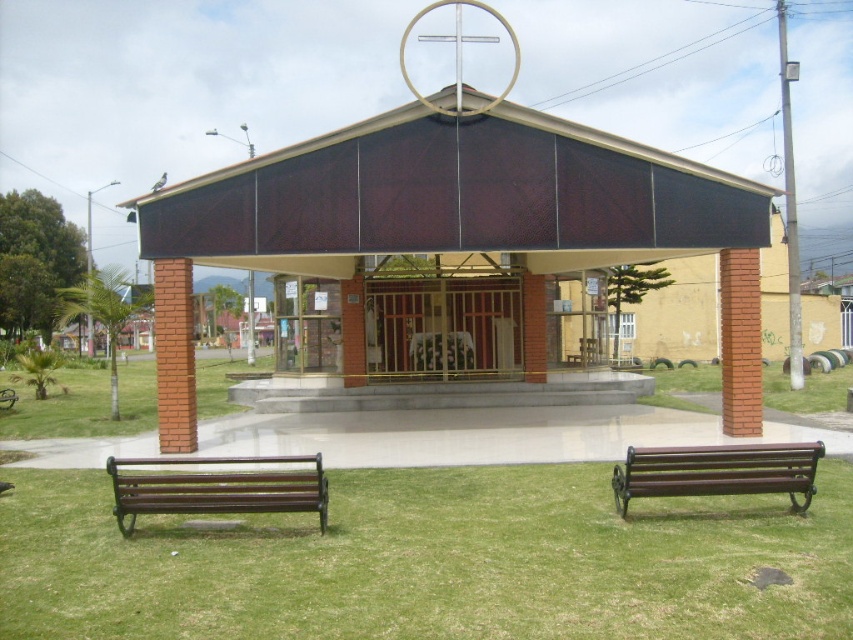
You are a visitor at this chapel and want to sit down. There are two benches available. The brown polished wood bench at lower left and the brown wooden bench at lower right. Which bench is positioned more to the left side of the scene?

The brown polished wood bench at lower left is positioned more to the left side of the scene compared to the brown wooden bench at lower right.

You are standing in front of the matte brown chapel at center and want to walk towards the green grass at lower center. In which direction should you move relative to the chapel?

The green grass at lower center is positioned on the right side of matte brown chapel at center, so you should move to the right of the chapel to reach the green grass at lower center.